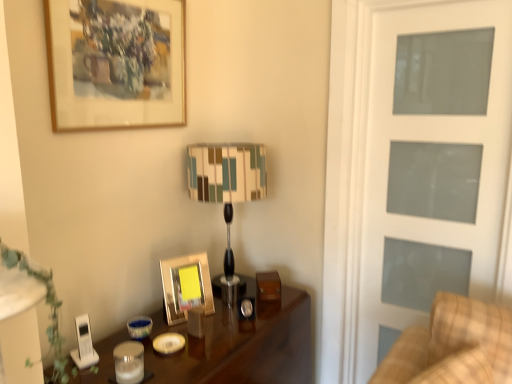
This screenshot has height=384, width=512. I want to click on vacant space situated above shiny dark wood table at center (from a real-world perspective), so click(201, 321).